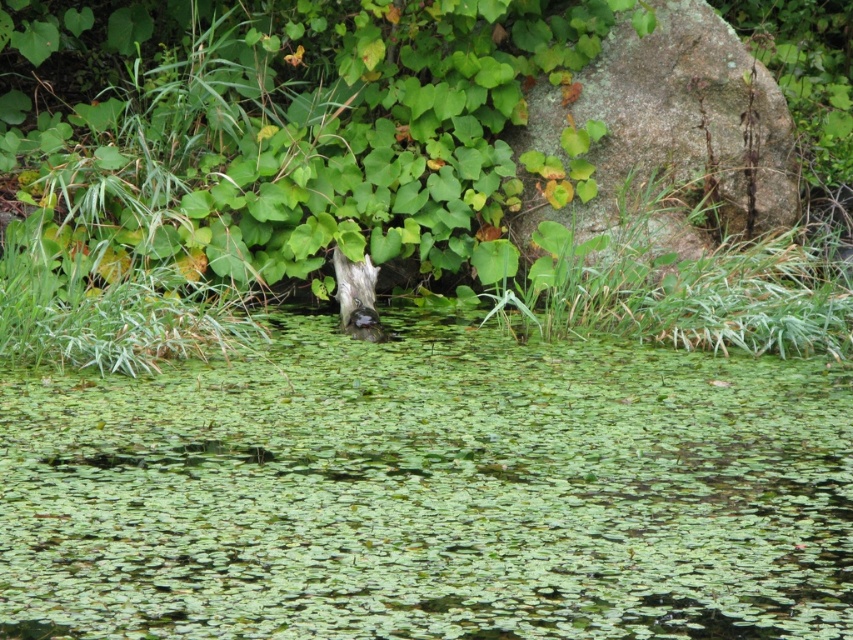
Is green leafy water at center wider than gray mossy rock at upper right?

Correct, the width of green leafy water at center exceeds that of gray mossy rock at upper right.

Is green leafy water at center below gray mossy rock at upper right?

Yes, green leafy water at center is below gray mossy rock at upper right.

What do you see at coordinates (428, 492) in the screenshot? This screenshot has height=640, width=853. I see `green leafy water at center` at bounding box center [428, 492].

You are a GUI agent. You are given a task and a screenshot of the screen. Output one action in this format:
    pyautogui.click(x=<x>, y=<y>)
    Task: Click on the green leafy water at center
    The width and height of the screenshot is (853, 640).
    Given the screenshot: What is the action you would take?
    pyautogui.click(x=428, y=492)